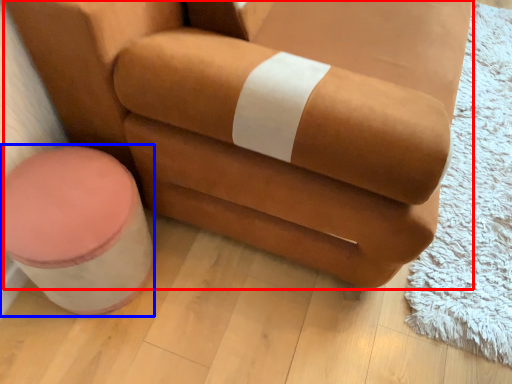
Question: Among these objects, which one is nearest to the camera, chair (highlighted by a red box) or stool (highlighted by a blue box)?

Choices:
 (A) chair
 (B) stool

Answer: (A)